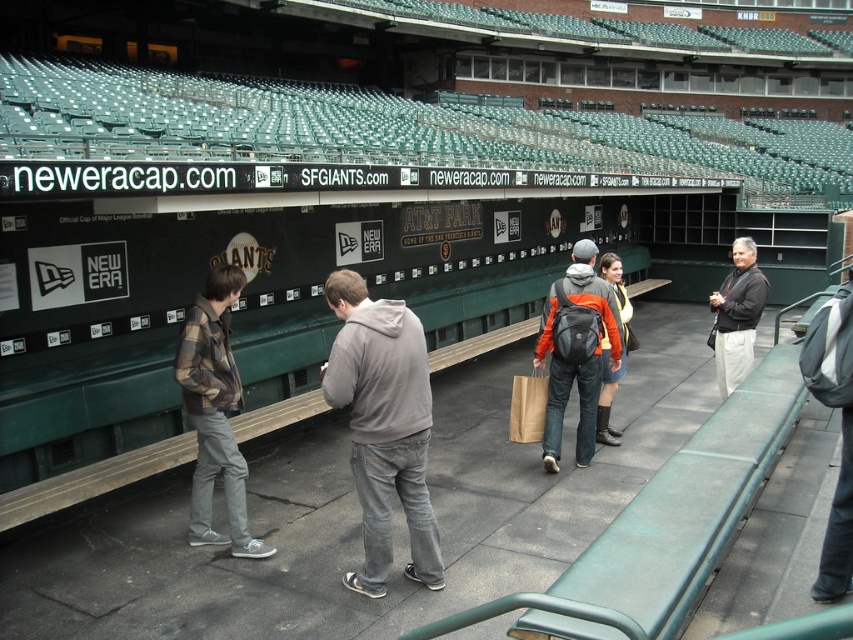
Question: Is green plastic bleachers at upper center thinner than khaki pants at right?

Choices:
 (A) no
 (B) yes

Answer: (A)

Question: Based on their relative distances, which object is farther from the green plastic bleachers at upper center?

Choices:
 (A) gray cotton hoodie at center
 (B) metallic silver scoreboard at center

Answer: (A)

Question: Among these points, which one is nearest to the camera?

Choices:
 (A) (370, 440)
 (B) (202, 348)
 (C) (538, 333)
 (D) (409, 113)

Answer: (A)

Question: Which of these objects is positioned farthest from the green plastic bleachers at upper center?

Choices:
 (A) gray cotton hoodie at center
 (B) metallic silver scoreboard at center
 (C) plaid flannel shirt at left
 (D) orange fleece jacket at center

Answer: (D)

Question: Is green plastic bleachers at upper center further to camera compared to plaid flannel shirt at left?

Choices:
 (A) no
 (B) yes

Answer: (A)

Question: Does gray cotton hoodie at center lie behind orange fabric jacket at center?

Choices:
 (A) no
 (B) yes

Answer: (A)